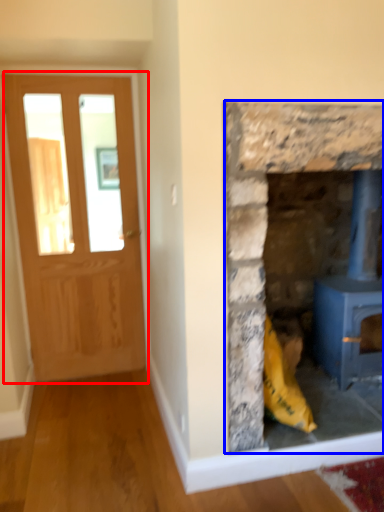
Question: Which of the following is the farthest to the observer, glass door (highlighted by a red box) or fireplace (highlighted by a blue box)?

Choices:
 (A) glass door
 (B) fireplace

Answer: (A)